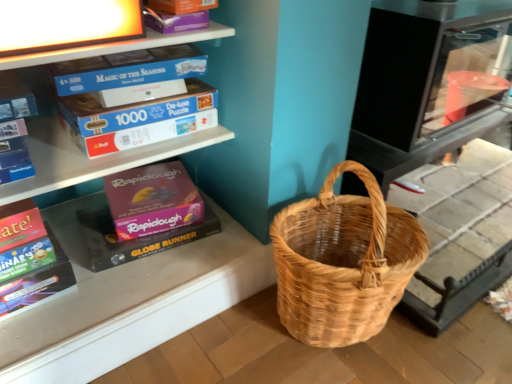
Question: Does white cardboard puzzle boxes at upper left contain natural woven picnic basket at lower right?

Choices:
 (A) yes
 (B) no

Answer: (B)

Question: From the image's perspective, is white cardboard puzzle boxes at upper left below natural woven picnic basket at lower right?

Choices:
 (A) yes
 (B) no

Answer: (B)

Question: Could you tell me if white cardboard puzzle boxes at upper left is facing natural woven picnic basket at lower right?

Choices:
 (A) yes
 (B) no

Answer: (B)

Question: Is the position of white cardboard puzzle boxes at upper left less distant than that of natural woven picnic basket at lower right?

Choices:
 (A) no
 (B) yes

Answer: (A)

Question: Is white cardboard puzzle boxes at upper left not inside natural woven picnic basket at lower right?

Choices:
 (A) yes
 (B) no

Answer: (A)

Question: Is white cardboard puzzle boxes at upper left looking in the opposite direction of natural woven picnic basket at lower right?

Choices:
 (A) no
 (B) yes

Answer: (A)

Question: Does natural woven picnic basket at lower right come behind multicolored cardboard book at lower left?

Choices:
 (A) no
 (B) yes

Answer: (A)

Question: Is multicolored cardboard book at lower left at the back of natural woven picnic basket at lower right?

Choices:
 (A) no
 (B) yes

Answer: (A)

Question: Is natural woven picnic basket at lower right wider than multicolored cardboard book at lower left?

Choices:
 (A) no
 (B) yes

Answer: (B)

Question: Is natural woven picnic basket at lower right far away from multicolored cardboard book at lower left?

Choices:
 (A) yes
 (B) no

Answer: (B)

Question: From the image's perspective, is natural woven picnic basket at lower right above multicolored cardboard book at lower left?

Choices:
 (A) yes
 (B) no

Answer: (B)

Question: Can you confirm if natural woven picnic basket at lower right is shorter than multicolored cardboard book at lower left?

Choices:
 (A) no
 (B) yes

Answer: (A)

Question: Can you confirm if white cardboard puzzle boxes at upper left is shorter than multicolored cardboard book at lower left?

Choices:
 (A) no
 (B) yes

Answer: (B)